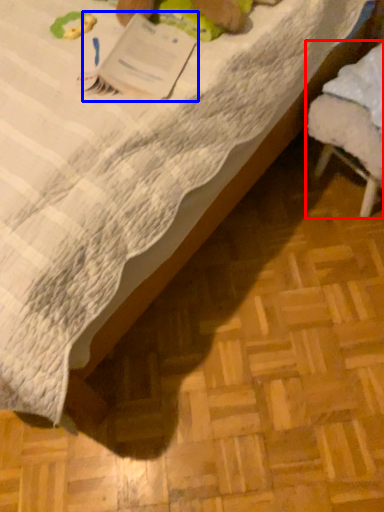
Question: Which point is further to the camera, furniture (highlighted by a red box) or paperback book (highlighted by a blue box)?

Choices:
 (A) furniture
 (B) paperback book

Answer: (A)